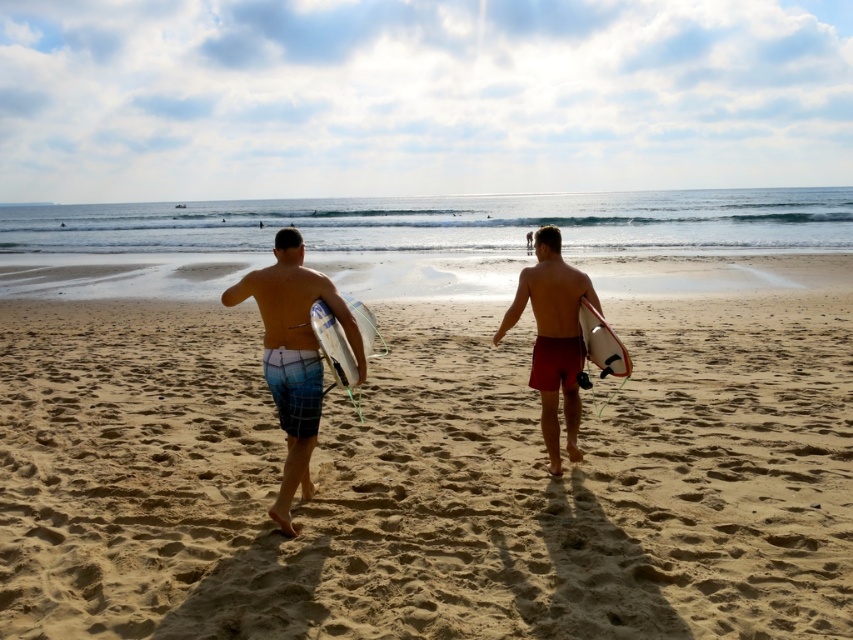
Looking at this image, can you confirm if blue plaid shorts at center is bigger than white glossy surfboard at center?

Yes.

Who is lower down, blue plaid shorts at center or white glossy surfboard at center?

blue plaid shorts at center is lower down.

Based on the photo, who is more distant from viewer, (279, 353) or (315, 323)?

Point (279, 353)

The height and width of the screenshot is (640, 853). I want to click on blue plaid shorts at center, so click(294, 355).

In the scene shown: Which is above, white glossy surfboard at center or white matte surfboard at center?

white glossy surfboard at center is higher up.

Is point (316, 330) less distant than point (618, 356)?

That is True.

This screenshot has height=640, width=853. What are the coordinates of `white glossy surfboard at center` in the screenshot? It's located at (334, 346).

Which is behind, point (234, 456) or point (271, 282)?

Positioned behind is point (234, 456).

Does sandy yellow sand at center have a smaller size compared to blue plaid boardshorts at center?

No, sandy yellow sand at center is not smaller than blue plaid boardshorts at center.

Identify the location of sandy yellow sand at center. (426, 481).

I want to click on sandy yellow sand at center, so 426,481.